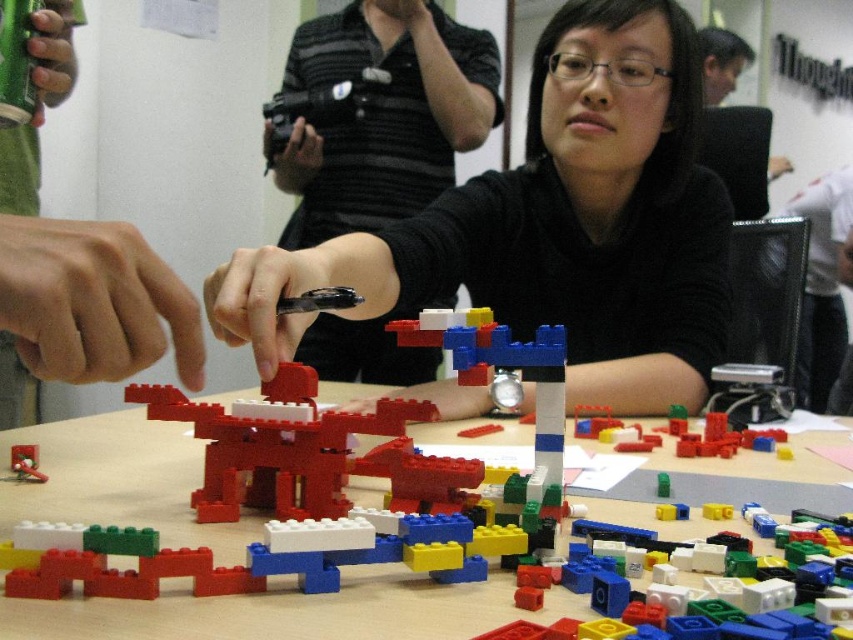
You are a photographer who needs to take a clear photo of the multicolored plastic blocks at center and the matte black camera at upper center. Which object will appear larger in the photo?

The multicolored plastic blocks at center will appear larger in the photo because they are closer to the viewer than the matte black camera at upper center.

From the picture: You are a child trying to build a tower with the multicolored plastic blocks at center and the smooth red toy at center. Which object should you pick first if you want to start with the one on the left?

You should pick the smooth red toy at center first because it is located to the left of the multicolored plastic blocks at center.

You are a photographer trying to set up a camera for a closeup shot of the LEGO tower. The camera is at point [384,115]. Where is the camera located relative to the LEGO tower?

The camera at point [384,115] is located at the upper center position relative to the LEGO tower.